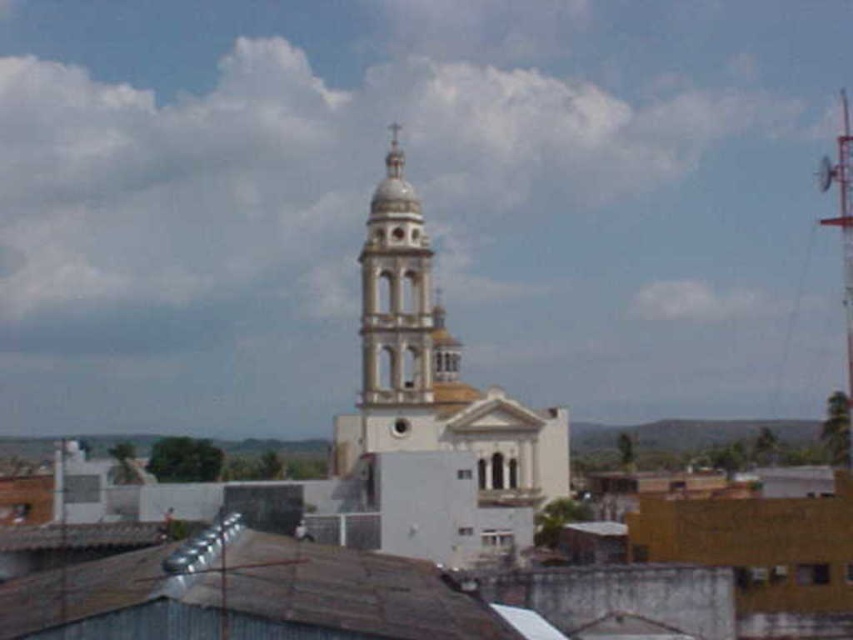
Is white stone church at center further to the viewer compared to white stone bell tower at center?

No, it is in front of white stone bell tower at center.

Between white stone church at center and white stone bell tower at center, which one appears on the right side from the viewer's perspective?

white stone bell tower at center

Identify the location of white stone church at center. The height and width of the screenshot is (640, 853). (434, 408).

I want to click on white stone church at center, so click(434, 408).